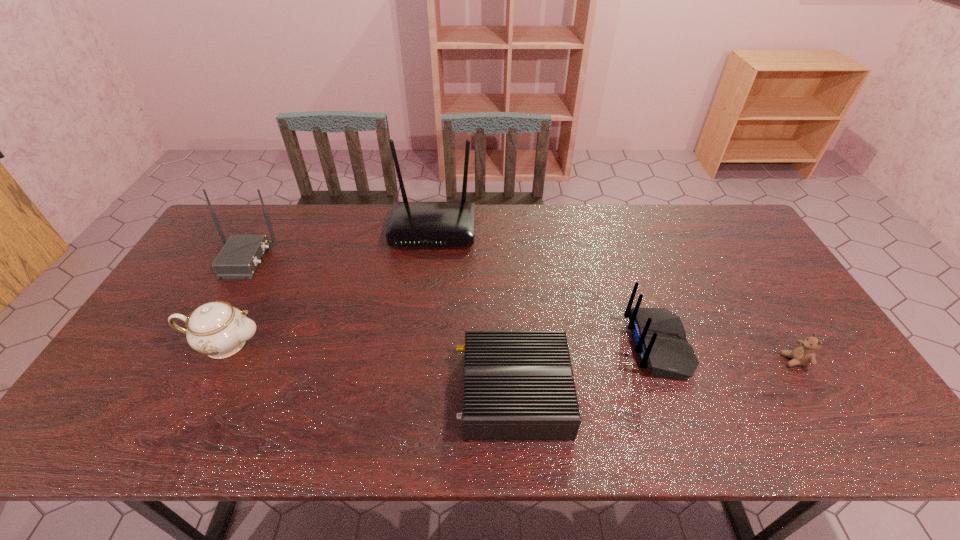
This screenshot has height=540, width=960. In order to click on vacant space situated on the back of the rightmost router in this screenshot , I will do `click(607, 346)`.

Locate an element on the screen. Image resolution: width=960 pixels, height=540 pixels. free space located 0.080m on the back of the rightmost router is located at coordinates [599, 346].

Where is `vacant space located on the back of the rightmost router`? The width and height of the screenshot is (960, 540). vacant space located on the back of the rightmost router is located at coordinates (554, 346).

The height and width of the screenshot is (540, 960). In order to click on vacant space situated at the spout of the chinaware in this screenshot , I will do `click(385, 343)`.

This screenshot has height=540, width=960. Find the location of `vacant region located 0.110m on the front-facing side of the rightmost object`. vacant region located 0.110m on the front-facing side of the rightmost object is located at coordinates (739, 360).

Identify the location of free region located 0.360m on the front-facing side of the rightmost object. [642, 360].

The height and width of the screenshot is (540, 960). What are the coordinates of `free space located 0.090m on the front-facing side of the rightmost object` in the screenshot? It's located at pos(747,360).

This screenshot has height=540, width=960. I want to click on free region located on the back panel of the shortest router, so click(344, 393).

The width and height of the screenshot is (960, 540). I want to click on vacant space located on the back panel of the shortest router, so click(x=336, y=393).

You are a GUI agent. You are given a task and a screenshot of the screen. Output one action in this format:
    pyautogui.click(x=<x>, y=<y>)
    Task: Click on the vacant area situated 0.300m on the back panel of the shortest router
    The height and width of the screenshot is (540, 960).
    Given the screenshot: What is the action you would take?
    pyautogui.click(x=332, y=393)